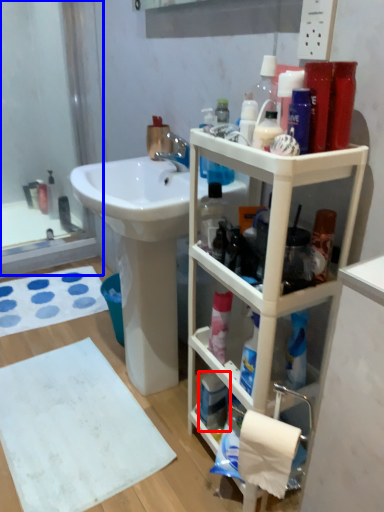
Question: Which object is further to the camera taking this photo, mouthwash (highlighted by a red box) or glass door (highlighted by a blue box)?

Choices:
 (A) mouthwash
 (B) glass door

Answer: (B)